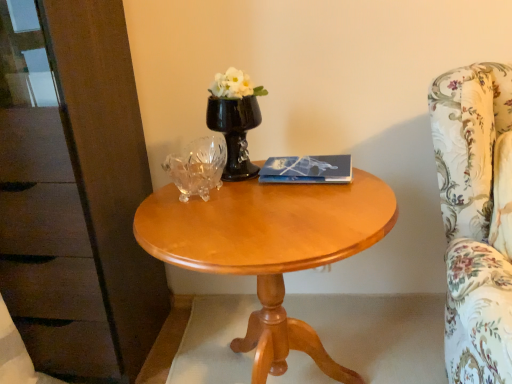
Question: From a real-world perspective, is black glass vase at center on top of floral fabric armchair at right?

Choices:
 (A) yes
 (B) no

Answer: (A)

Question: Is black glass vase at center further to the viewer compared to floral fabric armchair at right?

Choices:
 (A) no
 (B) yes

Answer: (B)

Question: From the image's perspective, is black glass vase at center on floral fabric armchair at right?

Choices:
 (A) no
 (B) yes

Answer: (B)

Question: Is black glass vase at center aimed at floral fabric armchair at right?

Choices:
 (A) no
 (B) yes

Answer: (A)

Question: Considering the relative sizes of black glass vase at center and floral fabric armchair at right in the image provided, is black glass vase at center bigger than floral fabric armchair at right?

Choices:
 (A) yes
 (B) no

Answer: (B)

Question: Is black glass vase at center taller than floral fabric armchair at right?

Choices:
 (A) no
 (B) yes

Answer: (A)

Question: Does blue glossy book at center have a lesser width compared to floral fabric armchair at right?

Choices:
 (A) yes
 (B) no

Answer: (A)

Question: Would you say blue glossy book at center is a long distance from floral fabric armchair at right?

Choices:
 (A) no
 (B) yes

Answer: (A)

Question: From the image's perspective, would you say blue glossy book at center is positioned over floral fabric armchair at right?

Choices:
 (A) no
 (B) yes

Answer: (B)

Question: From a real-world perspective, is blue glossy book at center located beneath floral fabric armchair at right?

Choices:
 (A) yes
 (B) no

Answer: (B)

Question: Does blue glossy book at center have a lesser height compared to floral fabric armchair at right?

Choices:
 (A) yes
 (B) no

Answer: (A)

Question: Does blue glossy book at center have a larger size compared to floral fabric armchair at right?

Choices:
 (A) no
 (B) yes

Answer: (A)

Question: Could you tell me if glossy wood table at center is facing floral fabric armchair at right?

Choices:
 (A) yes
 (B) no

Answer: (B)